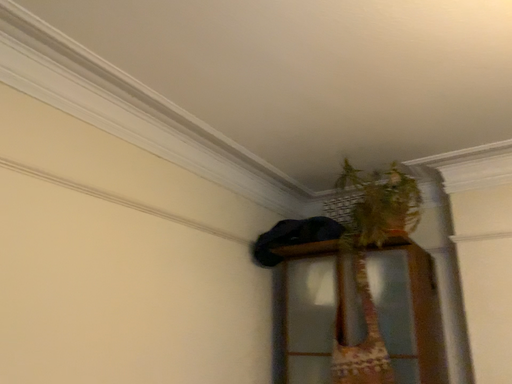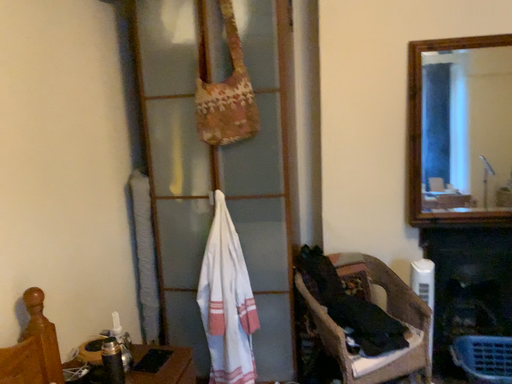
Question: How did the camera likely rotate when shooting the video?

Choices:
 (A) rotated downward
 (B) rotated upward

Answer: (A)